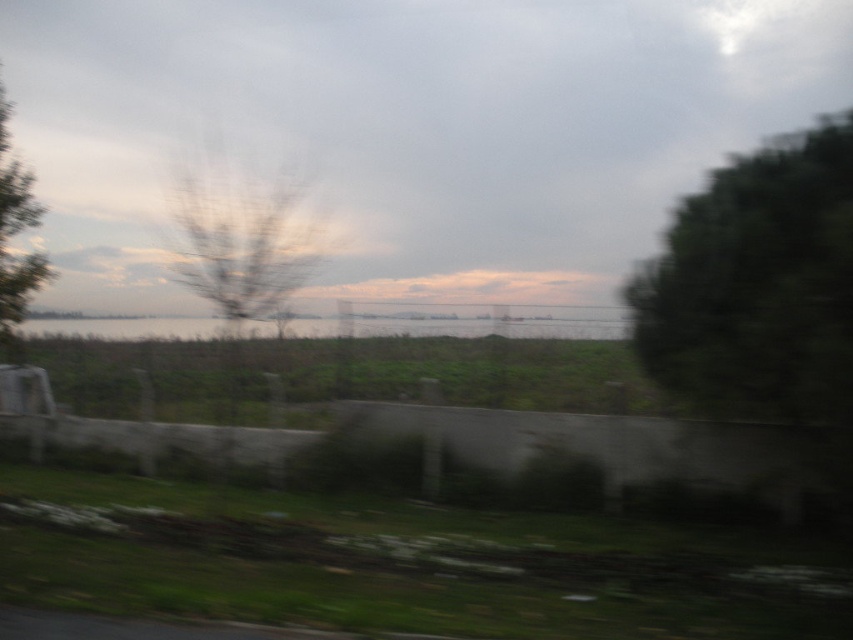
Can you confirm if brown leafless branches at center is smaller than green leafy tree at left?

No, brown leafless branches at center is not smaller than green leafy tree at left.

Is point (186, 280) positioned in front of point (22, 193)?

That is True.

Measure the distance between brown leafless branches at center and camera.

brown leafless branches at center and camera are 7.08 meters apart from each other.

Image resolution: width=853 pixels, height=640 pixels. In order to click on brown leafless branches at center in this screenshot , I will do `click(244, 243)`.

At what (x,y) coordinates should I click in order to perform the action: click on green leafy tree at right. Please return your answer as a coordinate pair (x, y). This screenshot has width=853, height=640. Looking at the image, I should click on (762, 300).

Is point (773, 273) more distant than point (236, 365)?

Yes, it is.

You are a GUI agent. You are given a task and a screenshot of the screen. Output one action in this format:
    pyautogui.click(x=<x>, y=<y>)
    Task: Click on the green leafy tree at right
    The height and width of the screenshot is (640, 853).
    Given the screenshot: What is the action you would take?
    pyautogui.click(x=762, y=300)

Between green leafy tree at right and clear water at center, which one has less height?

With less height is clear water at center.

Can you confirm if green leafy tree at right is bigger than clear water at center?

Actually, green leafy tree at right might be smaller than clear water at center.

Locate an element on the screen. Image resolution: width=853 pixels, height=640 pixels. green leafy tree at right is located at coordinates (762, 300).